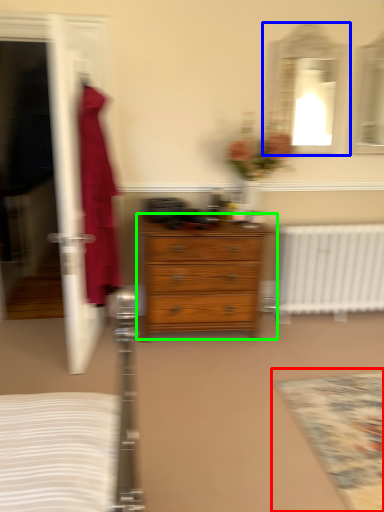
Question: Estimate the real-world distances between objects in this image. Which object is farther from mat (highlighted by a red box), mirror (highlighted by a blue box) or chest of drawers (highlighted by a green box)?

Choices:
 (A) mirror
 (B) chest of drawers

Answer: (A)